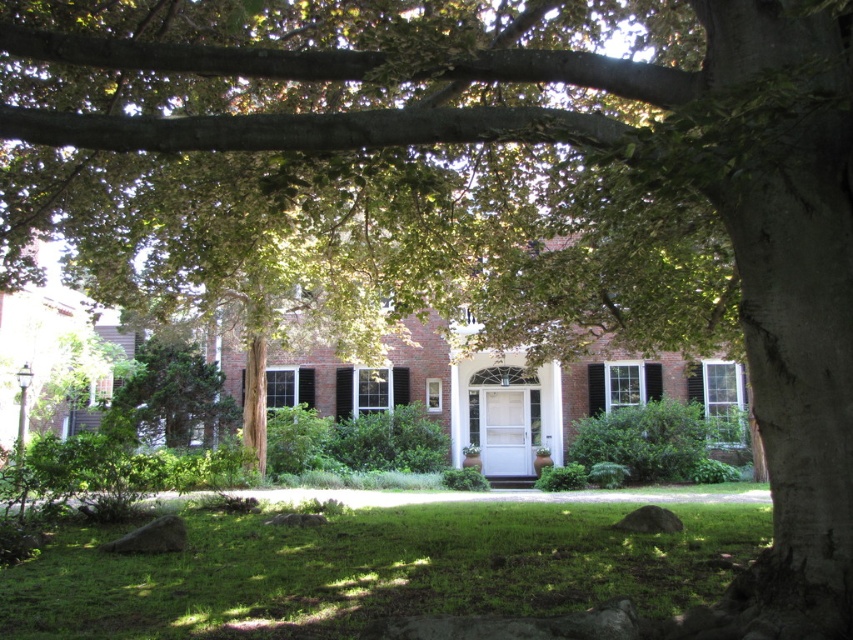
Question: Which point is farther to the camera?

Choices:
 (A) white painted wood shutter at center
 (B) white painted wood shutter at center right
 (C) green grass at center
 (D) white painted wood shutter at center left

Answer: (D)

Question: Which of the following is the closest to the observer?

Choices:
 (A) pyautogui.click(x=340, y=410)
 (B) pyautogui.click(x=648, y=396)
 (C) pyautogui.click(x=730, y=429)
 (D) pyautogui.click(x=294, y=397)

Answer: (C)

Question: Does green grass at center appear on the right side of black wood shutter at center?

Choices:
 (A) no
 (B) yes

Answer: (B)

Question: Considering the relative positions of white painted wood shutter at center and black wood shutter at center in the image provided, where is white painted wood shutter at center located with respect to black wood shutter at center?

Choices:
 (A) below
 (B) above

Answer: (A)

Question: Does green grass at center appear under white painted wood shutter at center right?

Choices:
 (A) no
 (B) yes

Answer: (B)

Question: Estimate the real-world distances between objects in this image. Which object is closer to the green grass at center?

Choices:
 (A) white painted wood shutter at center right
 (B) white painted wood shutter at center
 (C) white painted wood shutter at center left

Answer: (A)